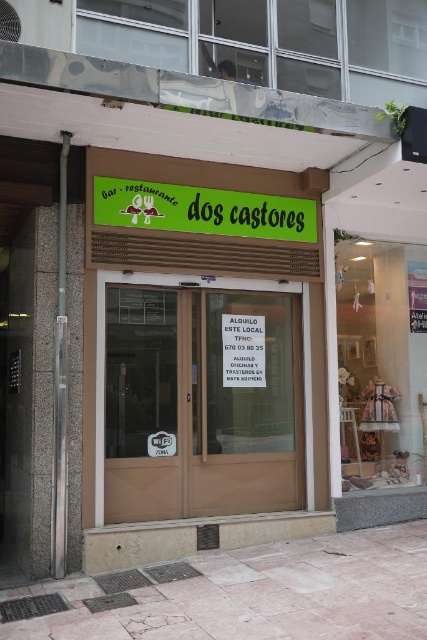
Question: Which object appears farthest from the camera in this image?

Choices:
 (A) green matte signboard at upper center
 (B) brown glass door at center

Answer: (A)

Question: From the image, what is the correct spatial relationship of green matte signboard at upper center in relation to white paper sign at center?

Choices:
 (A) below
 (B) above

Answer: (B)

Question: Can you confirm if brown glass door at center is positioned to the right of green matte signboard at upper center?

Choices:
 (A) yes
 (B) no

Answer: (B)

Question: Is green matte signboard at upper center further to the viewer compared to white paper sign at center?

Choices:
 (A) yes
 (B) no

Answer: (B)

Question: Estimate the real-world distances between objects in this image. Which object is farther from the white paper sign at center?

Choices:
 (A) brown glass door at center
 (B) green matte signboard at upper center

Answer: (B)

Question: Which point appears closest to the camera in this image?

Choices:
 (A) (246, 365)
 (B) (298, 227)
 (C) (266, 410)

Answer: (A)